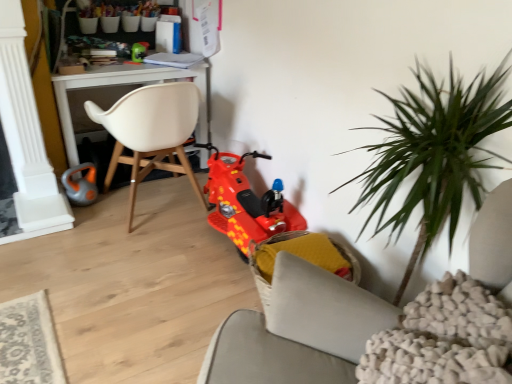
The image size is (512, 384). What are the coordinates of `vacant area to the left of yellow fabric chair at lower center, the 1th chair from the right` in the screenshot? It's located at (200, 302).